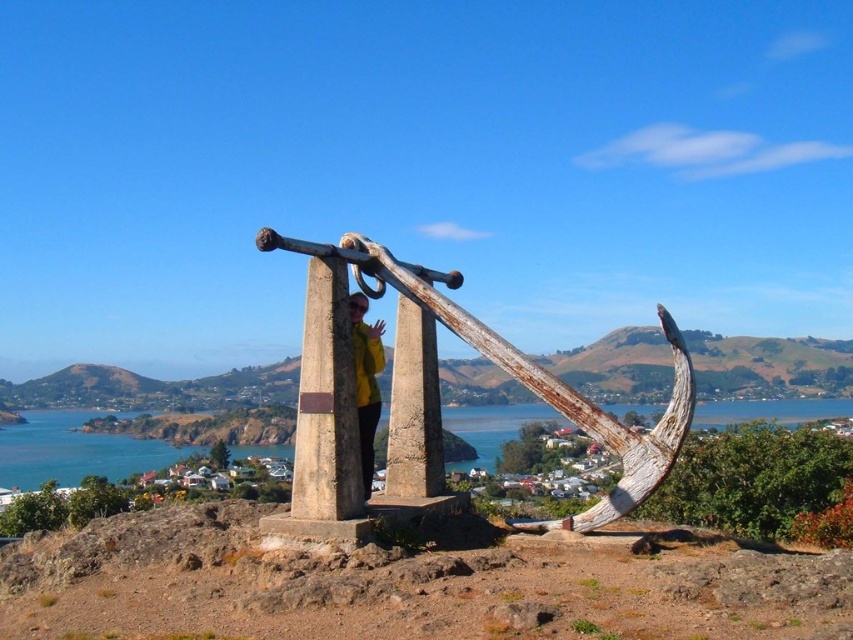
You are standing at the base of the anchor sculpture and want to take a photo of the blue water at center and the yellow matte jacket at center. Which object should you focus on first to ensure both are in the frame?

You should focus on the yellow matte jacket at center first because it is behind the blue water at center, so framing the jacket first will allow the water to naturally come into view in front of it.

You are a hiker who has just arrived at the coastal area and see the rusty metal anchor at center and the yellow matte jacket at center. Which object is positioned lower from your viewpoint?

The rusty metal anchor at center is located below the yellow matte jacket at center, so it is positioned lower from your viewpoint.